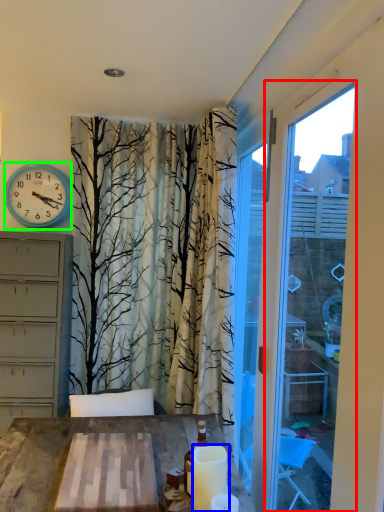
Question: Considering the real-world distances, which object is closest to window frame (highlighted by a red box)? candle (highlighted by a blue box) or wall clock (highlighted by a green box).

Choices:
 (A) candle
 (B) wall clock

Answer: (A)